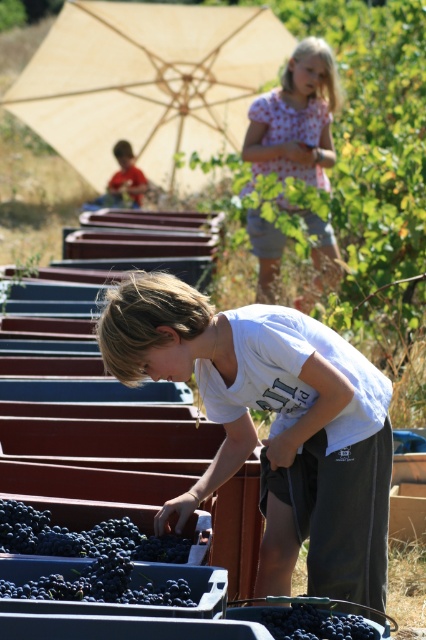
Question: Which object is the farthest from the light pink polka dot shirt at upper center?

Choices:
 (A) matte red shirt at upper left
 (B) dark purple grapes at lower center
 (C) white cotton shirt at center
 (D) beige fabric umbrella at upper center

Answer: (D)

Question: Does white cotton shirt at center come in front of dark purple grapes at lower center?

Choices:
 (A) no
 (B) yes

Answer: (A)

Question: Does white cotton shirt at center appear over matte red shirt at upper left?

Choices:
 (A) yes
 (B) no

Answer: (B)

Question: Which object is closer to the camera taking this photo?

Choices:
 (A) white cotton shirt at center
 (B) matte red shirt at upper left

Answer: (A)

Question: Does light pink polka dot shirt at upper center have a smaller size compared to dark purple grapes at lower center?

Choices:
 (A) no
 (B) yes

Answer: (A)

Question: Which of the following is the farthest from the observer?

Choices:
 (A) white cotton shirt at center
 (B) beige fabric umbrella at upper center

Answer: (B)